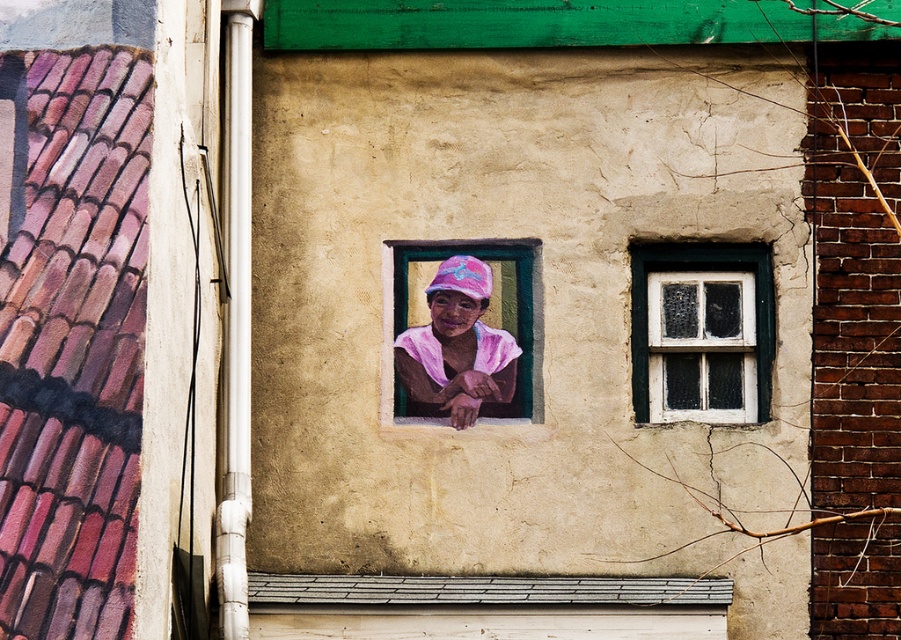
You are an architect inspecting a building facade. You need to locate the white painted wood at upper right. According to the coordinates provided, where exactly is it positioned on the image?

The white painted wood at upper right is located at the coordinate point of (x=701, y=269).

You are an interior designer assessing the wall space. You see the pink fabric at center and the white painted wood at upper right. Which object occupies a larger vertical space on the wall?

The white painted wood at upper right is taller than the pink fabric at center, so it occupies a larger vertical space on the wall.

You are standing in front of the building and notice the pink fabric at center. Can you determine its exact position relative to the window?

The pink fabric at center is located at point coordinates of 0.548 on the x axis and 0.508 on the y axis, so it is positioned slightly to the right and below the center of the window.